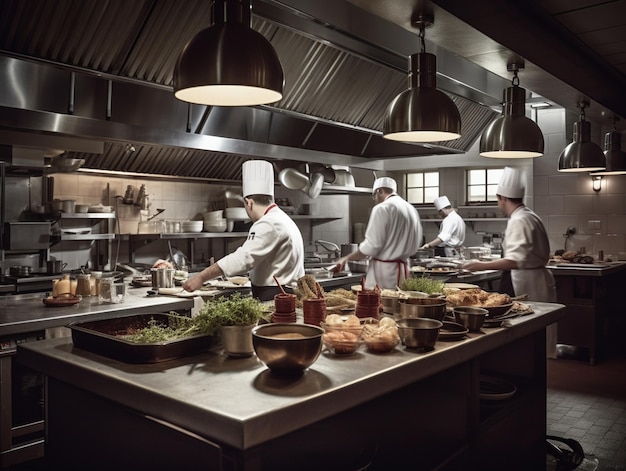
Find the location of a particular element. serving tray is located at coordinates (449, 329).